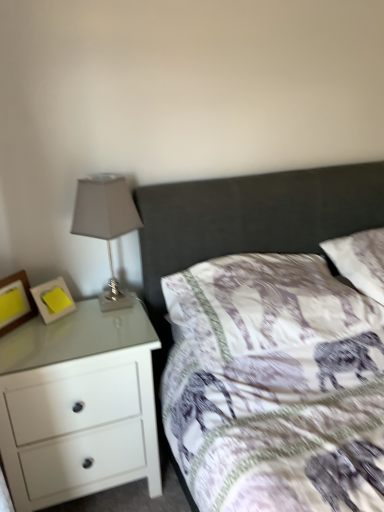
Question: Is white glossy chest of drawers at left placed right next to white soft pillow at upper right, acting as the 1th pillow starting from the right?

Choices:
 (A) yes
 (B) no

Answer: (B)

Question: From the image's perspective, does white glossy chest of drawers at left appear higher than white soft pillow at upper right, acting as the 1th pillow starting from the right?

Choices:
 (A) no
 (B) yes

Answer: (A)

Question: Is white glossy chest of drawers at left located outside white soft pillow at upper right, acting as the 1th pillow starting from the right?

Choices:
 (A) yes
 (B) no

Answer: (A)

Question: Is white glossy chest of drawers at left taller than white soft pillow at upper right, which appears as the second pillow when viewed from the left?

Choices:
 (A) yes
 (B) no

Answer: (A)

Question: Considering the relative sizes of white glossy chest of drawers at left and white soft pillow at upper right, which appears as the second pillow when viewed from the left, in the image provided, is white glossy chest of drawers at left bigger than white soft pillow at upper right, which appears as the second pillow when viewed from the left,?

Choices:
 (A) yes
 (B) no

Answer: (A)

Question: Are white glossy chest of drawers at left and white soft pillow at upper right, which appears as the second pillow when viewed from the left, located far from each other?

Choices:
 (A) no
 (B) yes

Answer: (B)

Question: Does matte gray glass table lamp at left come behind yellow paper at left, which is counted as the 2th picture frame, starting from the left?

Choices:
 (A) no
 (B) yes

Answer: (A)

Question: From the image's perspective, would you say matte gray glass table lamp at left is shown under yellow paper at left, marked as the 1th picture frame in a right-to-left arrangement?

Choices:
 (A) yes
 (B) no

Answer: (B)

Question: Is matte gray glass table lamp at left facing away from yellow paper at left, which is counted as the 2th picture frame, starting from the left?

Choices:
 (A) yes
 (B) no

Answer: (B)

Question: Is matte gray glass table lamp at left positioned before yellow paper at left, marked as the 1th picture frame in a right-to-left arrangement?

Choices:
 (A) yes
 (B) no

Answer: (A)

Question: Is matte gray glass table lamp at left positioned far away from yellow paper at left, marked as the 1th picture frame in a right-to-left arrangement?

Choices:
 (A) no
 (B) yes

Answer: (A)

Question: Considering the relative sizes of matte gray glass table lamp at left and yellow paper at left, marked as the 1th picture frame in a right-to-left arrangement, in the image provided, is matte gray glass table lamp at left bigger than yellow paper at left, marked as the 1th picture frame in a right-to-left arrangement,?

Choices:
 (A) no
 (B) yes

Answer: (B)

Question: Is matte gray glass table lamp at left shorter than white glossy chest of drawers at left?

Choices:
 (A) yes
 (B) no

Answer: (A)